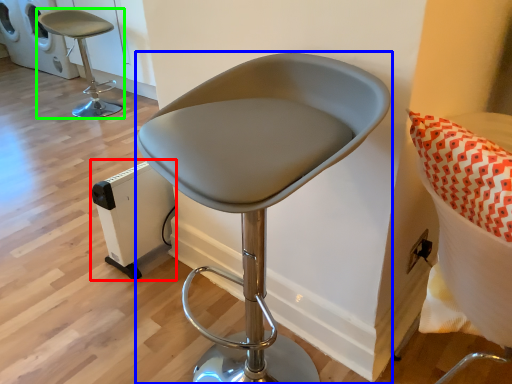
Question: Which object is positioned farthest from appliance (highlighted by a red box)? Select from chair (highlighted by a blue box) and chair (highlighted by a green box).

Choices:
 (A) chair
 (B) chair

Answer: (B)